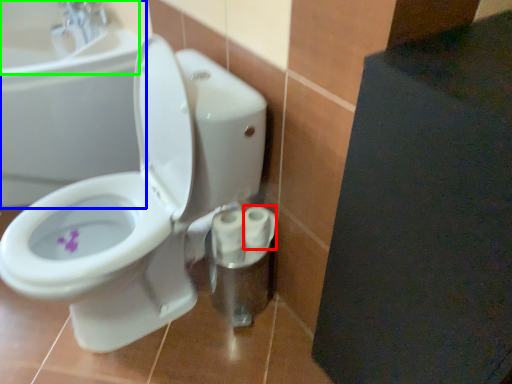
Question: Which object is the farthest from toilet paper (highlighted by a red box)? Choose among these: bath (highlighted by a blue box) or sink (highlighted by a green box).

Choices:
 (A) bath
 (B) sink

Answer: (B)